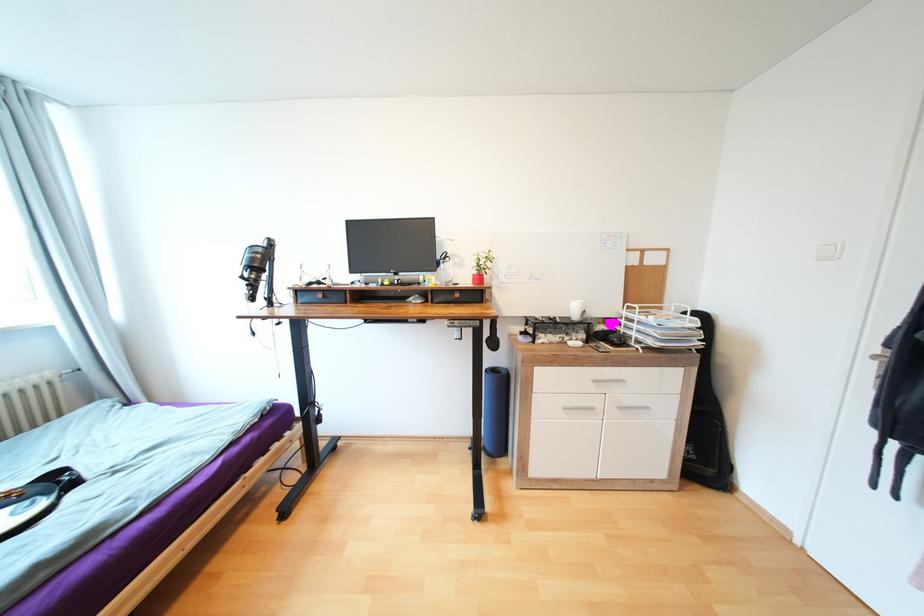
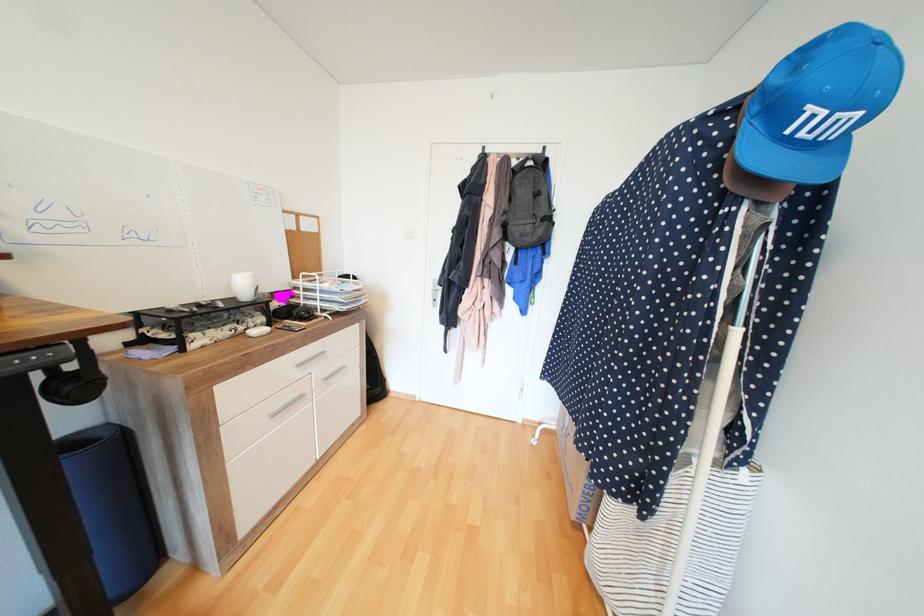
Find the pixel in the second image that matches [599,408] in the first image.

(309, 395)